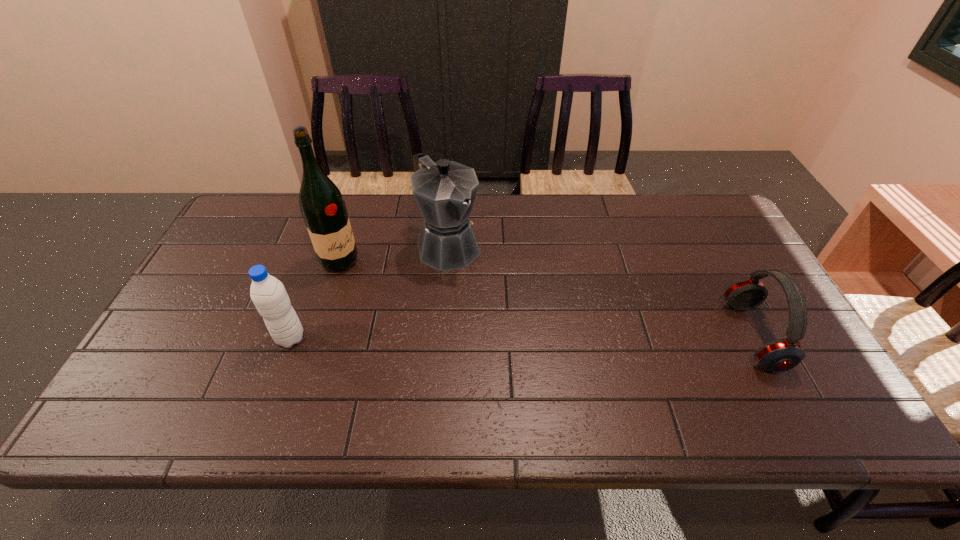
Identify the location of vacant space on the desktop that is between the water bottle and the earphone and is positioned on the front-facing side of the tallest object. (493, 338).

At what (x,y) coordinates should I click in order to perform the action: click on free space on the desktop that is between the third tallest object and the rightmost object and is positioned at the spout of the second object from right to left. Please return your answer as a coordinate pair (x, y). The height and width of the screenshot is (540, 960). Looking at the image, I should click on (536, 337).